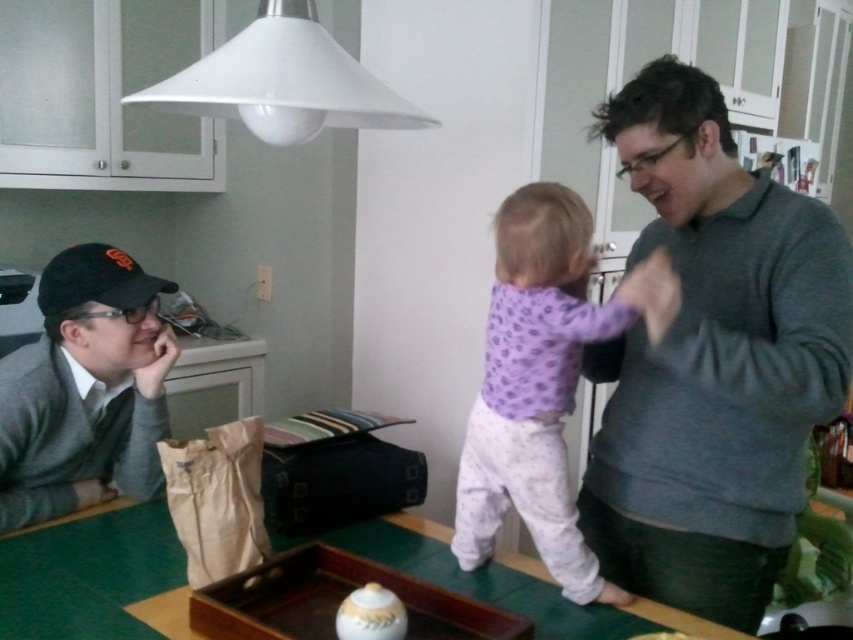
Question: Is green wooden table at center below brown paper bag at lower left?

Choices:
 (A) yes
 (B) no

Answer: (A)

Question: Based on their relative distances, which object is farther from the purple cotton shirt at center?

Choices:
 (A) green wooden table at center
 (B) brown paper bag at lower left

Answer: (B)

Question: Does gray sweater at right have a smaller size compared to green wooden table at center?

Choices:
 (A) yes
 (B) no

Answer: (B)

Question: Which point appears closest to the camera in this image?

Choices:
 (A) (548, 332)
 (B) (749, 342)
 (C) (529, 616)

Answer: (B)

Question: Based on their relative distances, which object is nearer to the gray sweater at right?

Choices:
 (A) purple cotton shirt at center
 (B) gray sweater at left
 (C) brown paper bag at lower left
 (D) green wooden table at center

Answer: (A)

Question: Can you confirm if green wooden table at center is positioned to the right of brown paper bag at lower left?

Choices:
 (A) no
 (B) yes

Answer: (B)